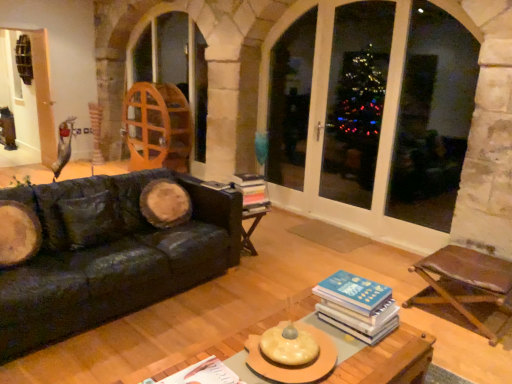
This screenshot has height=384, width=512. Find the location of `free location above blue hardcover book at center, which is counted as the 2th book, starting from the back (from a real-world perspective)`. free location above blue hardcover book at center, which is counted as the 2th book, starting from the back (from a real-world perspective) is located at coordinates (354, 288).